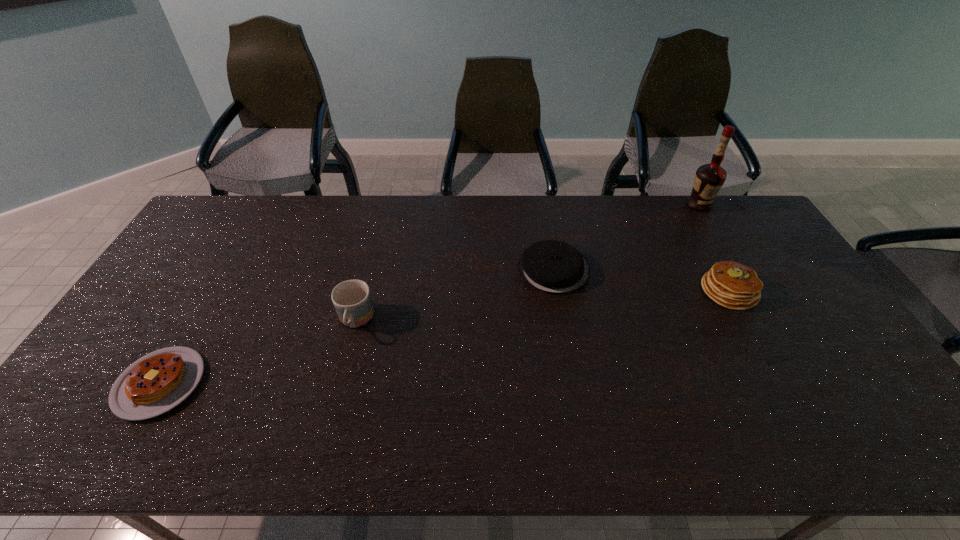
At what (x,y) coordinates should I click in order to perform the action: click on object that is at the near left corner. Please return your answer as a coordinate pair (x, y). The height and width of the screenshot is (540, 960). Looking at the image, I should click on (157, 382).

This screenshot has width=960, height=540. In order to click on object at the far right corner in this screenshot , I will do `click(709, 178)`.

Where is `vacant region at the far edge of the desktop`? The image size is (960, 540). vacant region at the far edge of the desktop is located at coordinates (502, 212).

This screenshot has height=540, width=960. In the image, there is a desktop. What are the coordinates of `vacant space at the near edge` in the screenshot? It's located at (694, 421).

What are the coordinates of `vacant area at the left edge` in the screenshot? It's located at (160, 322).

Locate an element on the screen. vacant region at the right edge of the desktop is located at coordinates (740, 239).

In the image, there is a desktop. Identify the location of free space at the far right corner. Image resolution: width=960 pixels, height=540 pixels. (733, 214).

Identify the location of vacant area that lies between the farthest object and the third object from left to right. This screenshot has height=540, width=960. (626, 237).

Where is `free spot between the rightmost pancake and the farthest object`? This screenshot has height=540, width=960. free spot between the rightmost pancake and the farthest object is located at coordinates (714, 248).

Identify the location of vacant area that lies between the fourth shortest object and the third shortest object. The width and height of the screenshot is (960, 540). (542, 306).